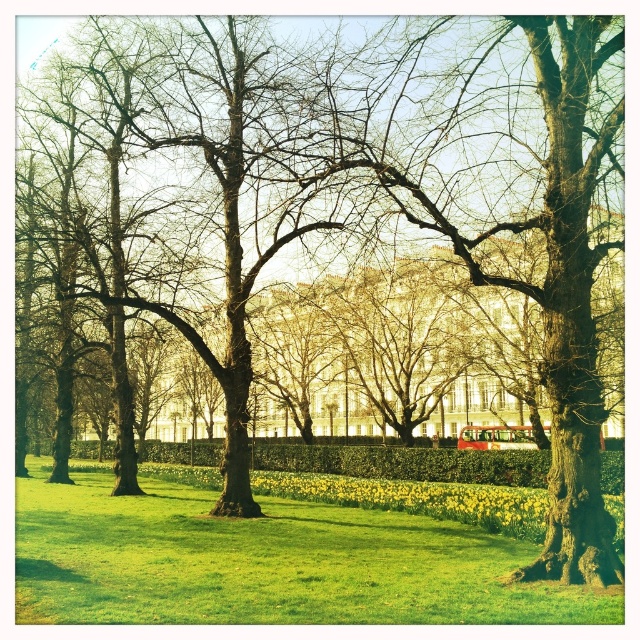
Is green grassy at center to the left of green leafy hedge at center from the viewer's perspective?

Yes, green grassy at center is to the left of green leafy hedge at center.

The height and width of the screenshot is (640, 640). I want to click on green grassy at center, so click(266, 563).

Identify the location of green grassy at center. The height and width of the screenshot is (640, 640). (266, 563).